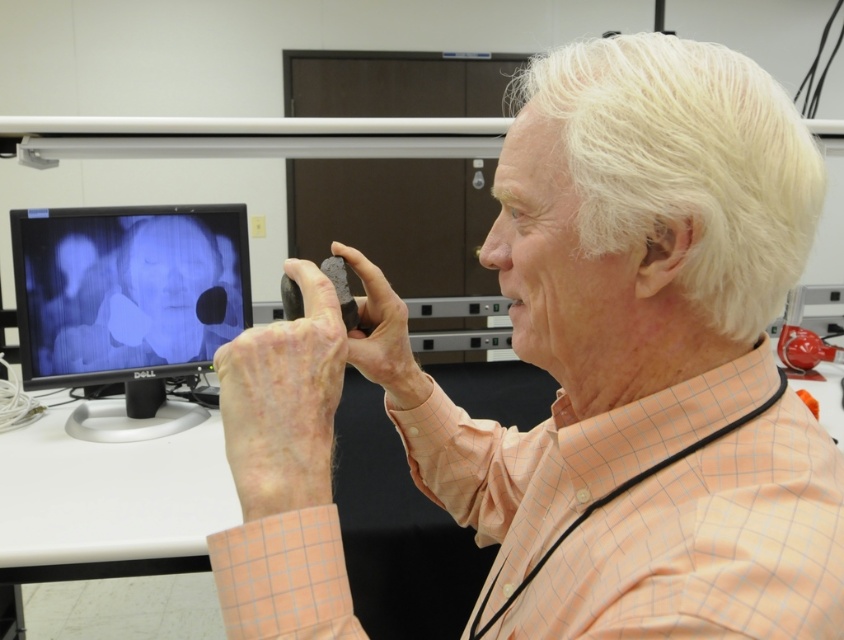
You are a researcher in the lab and need to place a label next to the matte black rock at center. Since the matte black monitor at left is already occupied, can you move the rock to the left side of the monitor?

The matte black rock at center is already to the right of the matte black monitor at left, so moving it to the left side of the monitor would require placing it in a new position that is not currently described. However, based on the given information, the rock is positioned to the right of the monitor, so moving it to the left side might be possible if there is space available. The description does not provide details about the spatial constraints or available space around the monitor.

You are a researcher in the lab and need to place the matte black rock at center on the shelf above the matte black monitor at left. Can the rock fit vertically without tilting it?

The matte black rock at center has a lesser height compared to the matte black monitor at left, so it can fit vertically on the shelf above without tilting.

You are a researcher in the lab who needs to place the matte black rock at center onto the matte black monitor at left for an experiment. Can you safely move the rock to the monitor without it falling off the edge?

The distance between the matte black rock at center and the matte black monitor at left is 1.16 meters. Since the rock is being moved directly to the monitor, as long as the placement is accurate, it should fit without falling off, assuming the monitor has enough surface area. However, the description does not provide the dimensions of the monitor or the rock, so caution is advised.